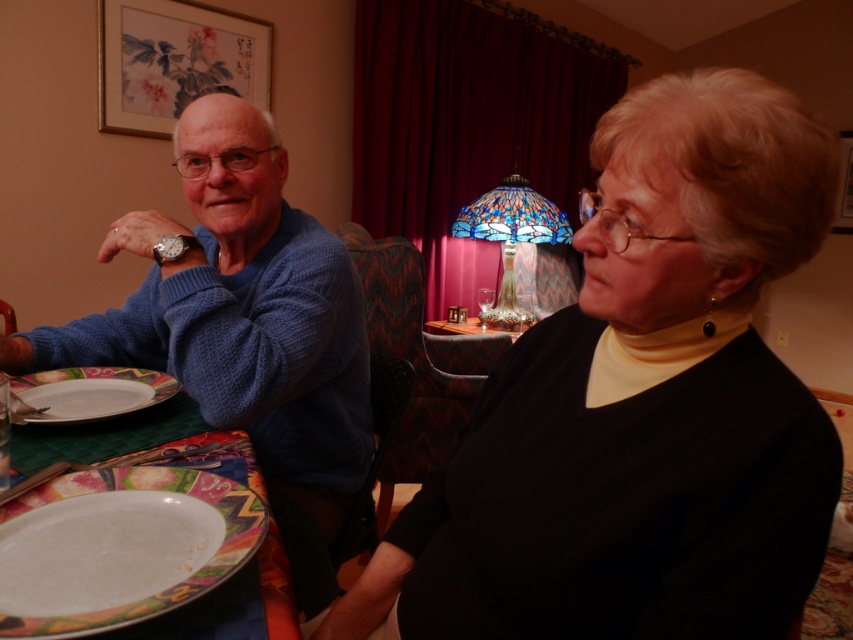
You are standing in front of the dining table and want to place a 18 inch wide decorative plate between the black matte dress at center and yourself. Is there enough space to place it without moving any existing items?

The distance between the black matte dress at center and the viewer is 20.37 inches. Since the decorative plate is 18 inches wide, there is sufficient space to place it without moving existing items as 18 inches is less than 20.37 inches.